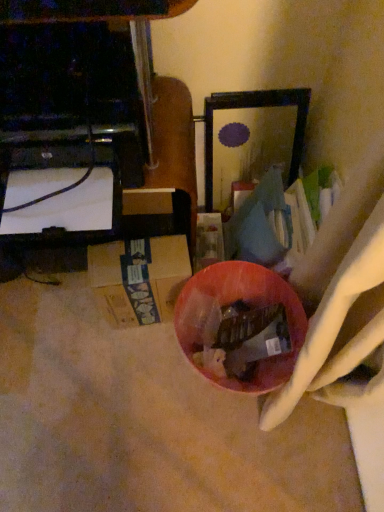
Question: Does shiny plastic bowl at center lie in front of black glossy tv stand at left?

Choices:
 (A) yes
 (B) no

Answer: (B)

Question: Is shiny plastic bowl at center not close to black glossy tv stand at left?

Choices:
 (A) no
 (B) yes

Answer: (A)

Question: From the image's perspective, is shiny plastic bowl at center below black glossy tv stand at left?

Choices:
 (A) no
 (B) yes

Answer: (B)

Question: Could you tell me if shiny plastic bowl at center is facing black glossy tv stand at left?

Choices:
 (A) yes
 (B) no

Answer: (B)

Question: Is black glossy tv stand at left a part of shiny plastic bowl at center?

Choices:
 (A) yes
 (B) no

Answer: (B)

Question: Can you see shiny plastic bowl at center touching black glossy tv stand at left?

Choices:
 (A) yes
 (B) no

Answer: (B)

Question: Can you confirm if black glossy tv stand at left is positioned to the left of shiny plastic bowl at center?

Choices:
 (A) no
 (B) yes

Answer: (B)

Question: Is black glossy tv stand at left not close to shiny plastic bowl at center?

Choices:
 (A) no
 (B) yes

Answer: (A)

Question: From the image's perspective, is black glossy tv stand at left over shiny plastic bowl at center?

Choices:
 (A) yes
 (B) no

Answer: (A)

Question: Considering the relative positions of black glossy tv stand at left and shiny plastic bowl at center in the image provided, is black glossy tv stand at left in front of shiny plastic bowl at center?

Choices:
 (A) no
 (B) yes

Answer: (B)

Question: Could shiny plastic bowl at center be considered to be inside black glossy tv stand at left?

Choices:
 (A) no
 (B) yes

Answer: (A)

Question: From a real-world perspective, does black glossy tv stand at left stand above shiny plastic bowl at center?

Choices:
 (A) yes
 (B) no

Answer: (A)

Question: Based on their positions, is shiny plastic bowl at center located to the left or right of black glossy tv stand at left?

Choices:
 (A) left
 (B) right

Answer: (B)